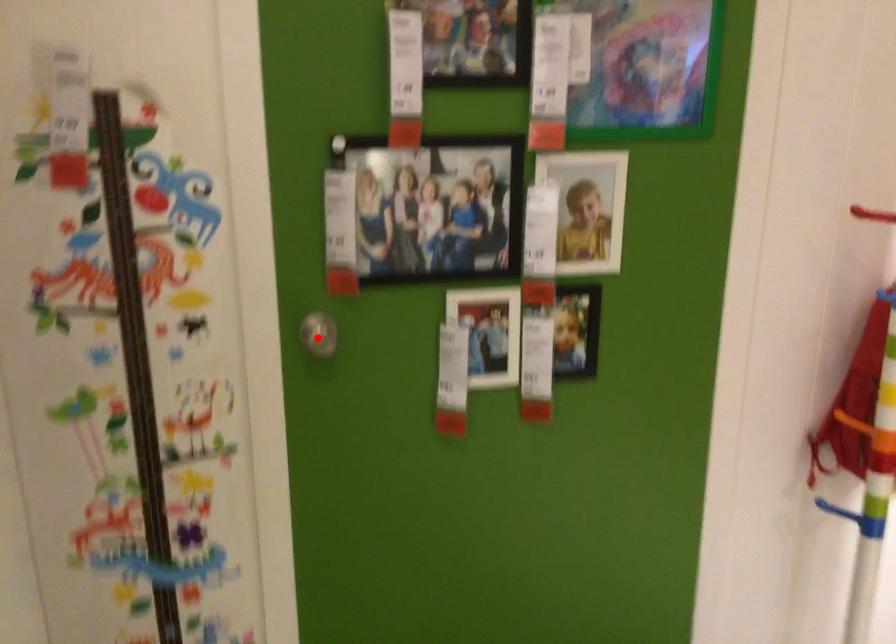
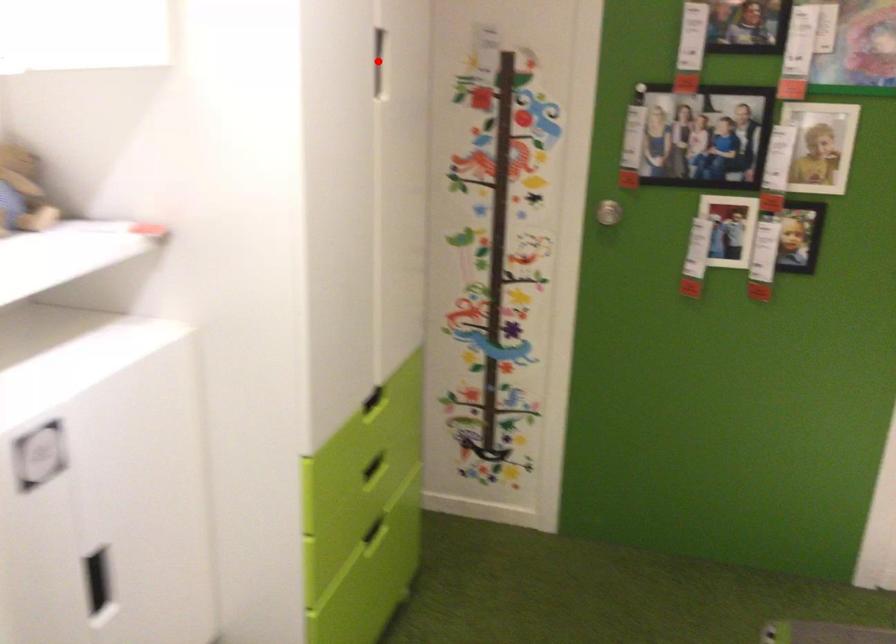
I am providing you with two images of the same scene from different viewpoints. A red point is marked on the first image and another point is marked on the second image. Are the points marked in image1 and image2 representing the same 3D position?

No